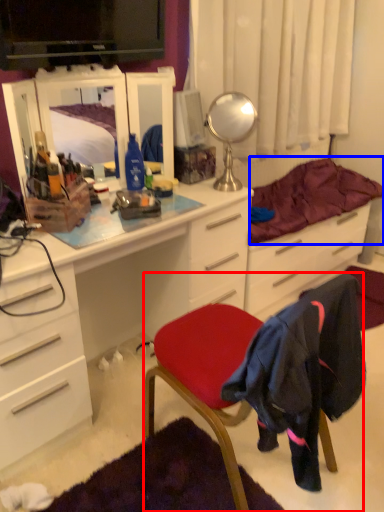
Question: Which point is closer to the camera, chair (highlighted by a red box) or bedding (highlighted by a blue box)?

Choices:
 (A) chair
 (B) bedding

Answer: (A)